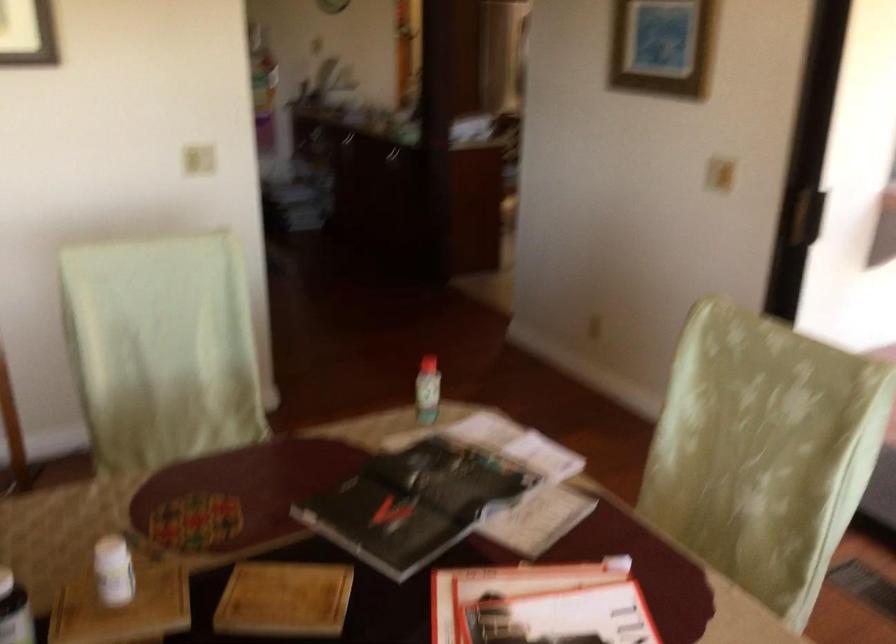
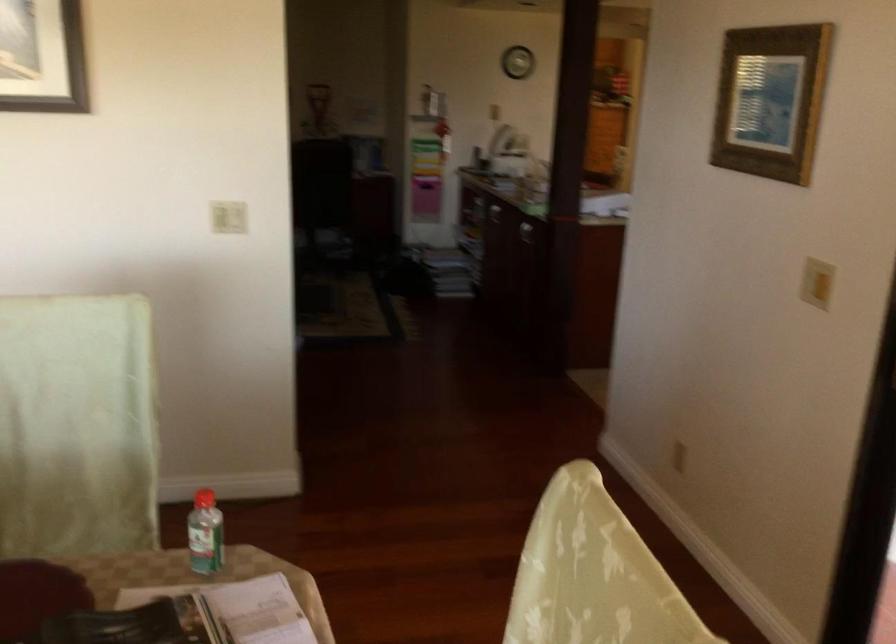
In a continuous first-person perspective shot, in which direction is the camera moving?

The movement direction of the cameraman is right, forward.